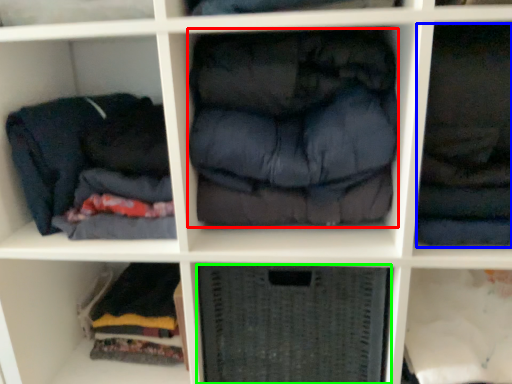
Question: Which object is positioned closest to clothing (highlighted by a red box)? Select from clothing (highlighted by a blue box) and shelf (highlighted by a green box).

Choices:
 (A) clothing
 (B) shelf

Answer: (A)